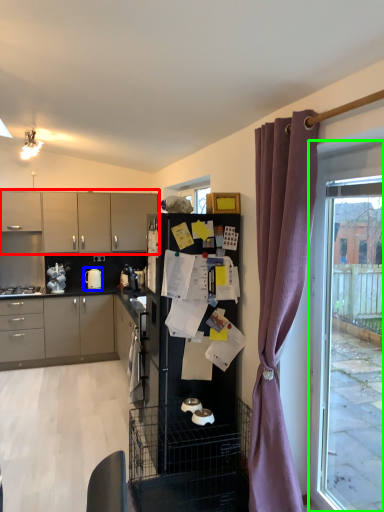
Question: Which object is positioned closest to cabinetry (highlighted by a red box)? Select from kitchen appliance (highlighted by a blue box) and window (highlighted by a green box).

Choices:
 (A) kitchen appliance
 (B) window

Answer: (A)